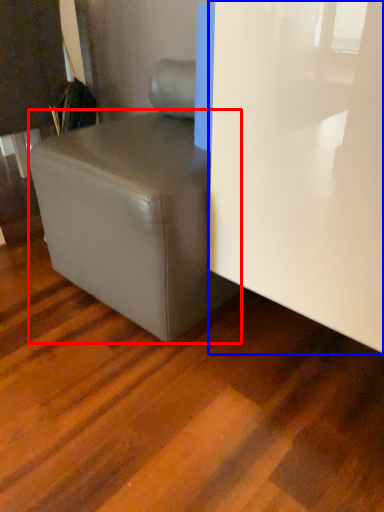
Question: Which object is further to the camera taking this photo, table (highlighted by a red box) or glass door (highlighted by a blue box)?

Choices:
 (A) table
 (B) glass door

Answer: (A)